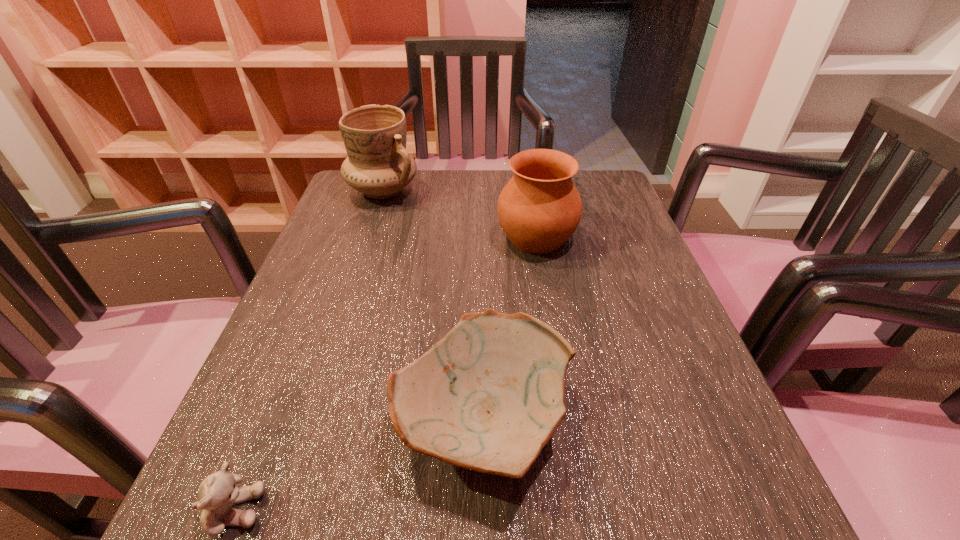
What are the coordinates of `the farthest pottery` in the screenshot? It's located at (378, 164).

Image resolution: width=960 pixels, height=540 pixels. What are the coordinates of `the leftmost pottery` in the screenshot? It's located at (378, 164).

The width and height of the screenshot is (960, 540). Find the location of `the second farthest pottery`. the second farthest pottery is located at coordinates [539, 209].

The image size is (960, 540). In order to click on the nearest pottery in this screenshot , I will do `click(488, 397)`.

Find the location of a particular element. the third tallest object is located at coordinates (488, 397).

Where is `vacant space located 0.240m on the right of the leftmost pottery`? This screenshot has width=960, height=540. vacant space located 0.240m on the right of the leftmost pottery is located at coordinates (510, 191).

Image resolution: width=960 pixels, height=540 pixels. What are the coordinates of `free spot located 0.390m on the left of the third nearest object` in the screenshot? It's located at (326, 238).

Locate an element on the screen. This screenshot has width=960, height=540. vacant area situated on the right of the second shortest object is located at coordinates (717, 419).

This screenshot has height=540, width=960. Identify the location of object that is at the near edge. pos(488,397).

This screenshot has height=540, width=960. I want to click on object situated at the left edge, so click(378, 164).